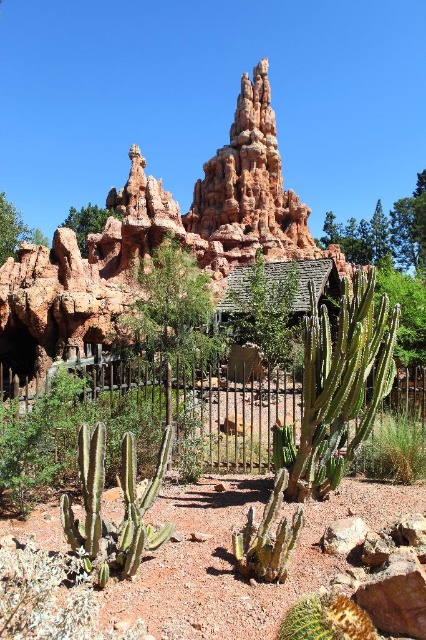
Consider the image. You are a visitor standing in front of the desert landscape scene. You want to take a photo of both the green spiny cactus at center and the green leafy bush at upper left. Which object should you focus on first to ensure both are in clear view?

You should focus on the green spiny cactus at center first because it is closer to the viewer than the green leafy bush at upper left, so adjusting focus to it will help both be in clear view.

You are a landscape designer planning to add a new plant to the desert scene. You have a small palm tree that is 1.5 meters tall. The green spiny cactus at center is currently 1.2 meters tall, and the green leafy bush at upper left is 1.8 meters tall. Can the palm tree fit between them without exceeding the height of either?

The green spiny cactus at center is 1.2 meters tall and the green leafy bush at upper left is 1.8 meters tall. The palm tree is 1.5 meters tall, which is taller than the green spiny cactus at center but shorter than the green leafy bush at upper left. Therefore, the palm tree can fit between them as it doesn

You are a visitor at this desert attraction and want to take a photo of both the iron wire fence at center and the rusty corrugated metal hut at center. Since you want both to be clearly visible in the frame, which object should you focus on first to ensure proper focus, considering their sizes?

The iron wire fence at center is larger in size than the rusty corrugated metal hut at center, so you should focus on the iron wire fence at center first to ensure both are in focus as it takes up more space in the frame.